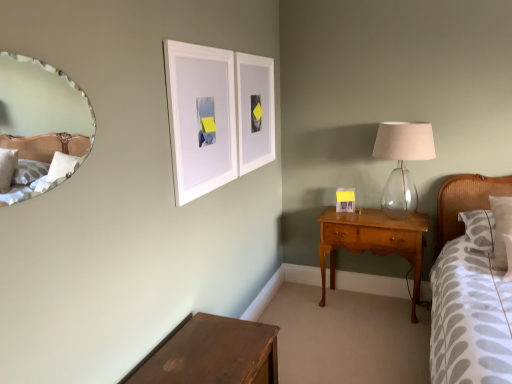
Question: Can you confirm if white matte picture frame at upper center, marked as the first picture frame in a front-to-back arrangement, is taller than matte white picture frame at right, which is the 1th picture frame in back-to-front order?

Choices:
 (A) no
 (B) yes

Answer: (B)

Question: From the image's perspective, is white matte picture frame at upper center, marked as the first picture frame in a front-to-back arrangement, over matte white picture frame at right, marked as the first picture frame in a right-to-left arrangement?

Choices:
 (A) no
 (B) yes

Answer: (B)

Question: From the image's perspective, is white matte picture frame at upper center, marked as the first picture frame in a front-to-back arrangement, under matte white picture frame at right, which ranks as the 3th picture frame in front-to-back order?

Choices:
 (A) yes
 (B) no

Answer: (B)

Question: Can you see white matte picture frame at upper center, acting as the 3th picture frame starting from the back, touching matte white picture frame at right, which ranks as the 3th picture frame in front-to-back order?

Choices:
 (A) yes
 (B) no

Answer: (B)

Question: Is the position of white matte picture frame at upper center, marked as the first picture frame in a front-to-back arrangement, more distant than that of matte white picture frame at right, the 3th picture frame from the left?

Choices:
 (A) no
 (B) yes

Answer: (A)

Question: In terms of size, does white textured pillow at right appear bigger or smaller than dark brown wooden table at lower left?

Choices:
 (A) big
 (B) small

Answer: (B)

Question: Looking at their shapes, would you say white textured pillow at right is wider or thinner than dark brown wooden table at lower left?

Choices:
 (A) thin
 (B) wide

Answer: (A)

Question: From a real-world perspective, is white textured pillow at right positioned above or below dark brown wooden table at lower left?

Choices:
 (A) above
 (B) below

Answer: (A)

Question: From the image's perspective, relative to dark brown wooden table at lower left, is white textured pillow at right above or below?

Choices:
 (A) below
 (B) above

Answer: (B)

Question: Is white textured pillow at right taller or shorter than light brown wood nightstand at center right?

Choices:
 (A) tall
 (B) short

Answer: (B)

Question: From a real-world perspective, is white textured pillow at right above or below light brown wood nightstand at center right?

Choices:
 (A) below
 (B) above

Answer: (B)

Question: Is point (484, 243) positioned closer to the camera than point (334, 240)?

Choices:
 (A) closer
 (B) farther

Answer: (A)

Question: Considering their positions, is white textured pillow at right located in front of or behind light brown wood nightstand at center right?

Choices:
 (A) front
 (B) behind

Answer: (A)

Question: Considering the positions of white matte picture frame at upper center, which is the 3th picture frame from right to left, and matte white picture frame at right, which ranks as the 3th picture frame in front-to-back order, in the image, is white matte picture frame at upper center, which is the 3th picture frame from right to left, taller or shorter than matte white picture frame at right, which ranks as the 3th picture frame in front-to-back order,?

Choices:
 (A) tall
 (B) short

Answer: (A)

Question: In the image, is white matte picture frame at upper center, acting as the 3th picture frame starting from the back, positioned in front of or behind matte white picture frame at right, which is the 1th picture frame in back-to-front order?

Choices:
 (A) behind
 (B) front

Answer: (B)